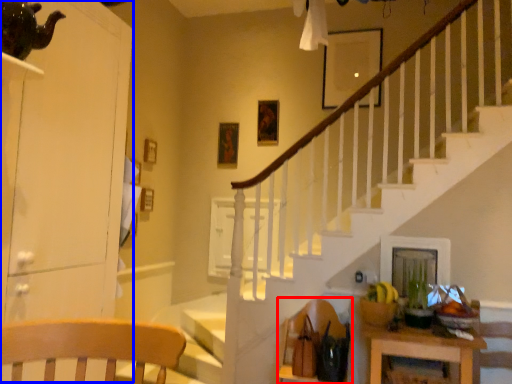
Question: Which object appears closest to the camera in this image, armchair (highlighted by a red box) or dresser (highlighted by a blue box)?

Choices:
 (A) armchair
 (B) dresser

Answer: (B)